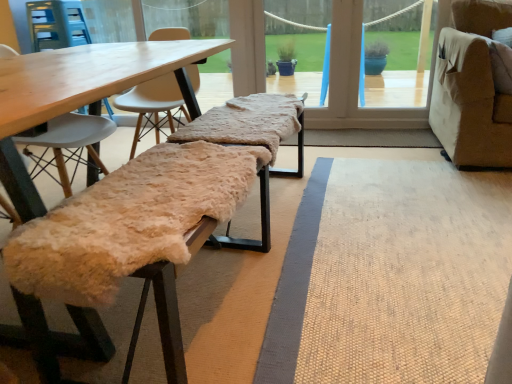
Question: From a real-world perspective, is fuzzy beige bench at lower left, which is the 1th park bench from bottom to top, over fuzzy woolen bench at center, acting as the second park bench starting from the bottom?

Choices:
 (A) no
 (B) yes

Answer: (A)

Question: From a real-world perspective, is fuzzy beige bench at lower left, arranged as the 2th park bench when viewed from the top, under fuzzy woolen bench at center, marked as the 1th park bench in a top-to-bottom arrangement?

Choices:
 (A) yes
 (B) no

Answer: (A)

Question: Is fuzzy beige bench at lower left, arranged as the 2th park bench when viewed from the top, looking in the opposite direction of fuzzy woolen bench at center, acting as the second park bench starting from the bottom?

Choices:
 (A) no
 (B) yes

Answer: (A)

Question: Is fuzzy beige bench at lower left, arranged as the 2th park bench when viewed from the top, positioned behind fuzzy woolen bench at center, marked as the 1th park bench in a top-to-bottom arrangement?

Choices:
 (A) yes
 (B) no

Answer: (B)

Question: Can you confirm if fuzzy beige bench at lower left, which is the 1th park bench from bottom to top, is wider than fuzzy woolen bench at center, marked as the 1th park bench in a top-to-bottom arrangement?

Choices:
 (A) no
 (B) yes

Answer: (A)

Question: Can you confirm if fuzzy beige bench at lower left, which is the 1th park bench from bottom to top, is thinner than fuzzy woolen bench at center, acting as the second park bench starting from the bottom?

Choices:
 (A) yes
 (B) no

Answer: (A)

Question: Is fuzzy woolen bench at center, acting as the second park bench starting from the bottom, aimed at fuzzy beige bench at lower left, arranged as the 2th park bench when viewed from the top?

Choices:
 (A) yes
 (B) no

Answer: (B)

Question: Is fuzzy woolen bench at center, marked as the 1th park bench in a top-to-bottom arrangement, wider than fuzzy beige bench at lower left, arranged as the 2th park bench when viewed from the top?

Choices:
 (A) yes
 (B) no

Answer: (A)

Question: Is fuzzy woolen bench at center, marked as the 1th park bench in a top-to-bottom arrangement, touching fuzzy beige bench at lower left, which is the 1th park bench from bottom to top?

Choices:
 (A) yes
 (B) no

Answer: (B)

Question: Is fuzzy woolen bench at center, acting as the second park bench starting from the bottom, positioned before fuzzy beige bench at lower left, arranged as the 2th park bench when viewed from the top?

Choices:
 (A) yes
 (B) no

Answer: (B)

Question: Is fuzzy woolen bench at center, marked as the 1th park bench in a top-to-bottom arrangement, positioned far away from fuzzy beige bench at lower left, which is the 1th park bench from bottom to top?

Choices:
 (A) yes
 (B) no

Answer: (B)

Question: Is fuzzy beige bench at lower left, arranged as the 2th park bench when viewed from the top, a part of fuzzy woolen bench at center, acting as the second park bench starting from the bottom?

Choices:
 (A) yes
 (B) no

Answer: (B)

Question: Considering the positions of fuzzy woolen bench at center, marked as the 1th park bench in a top-to-bottom arrangement, and fuzzy beige bench at lower left, arranged as the 2th park bench when viewed from the top, in the image, is fuzzy woolen bench at center, marked as the 1th park bench in a top-to-bottom arrangement, taller or shorter than fuzzy beige bench at lower left, arranged as the 2th park bench when viewed from the top,?

Choices:
 (A) short
 (B) tall

Answer: (A)